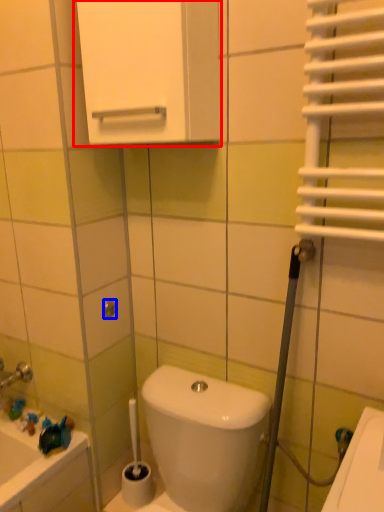
Question: Which point is further to the camera, medicine cabinet (highlighted by a red box) or shower (highlighted by a blue box)?

Choices:
 (A) medicine cabinet
 (B) shower

Answer: (B)